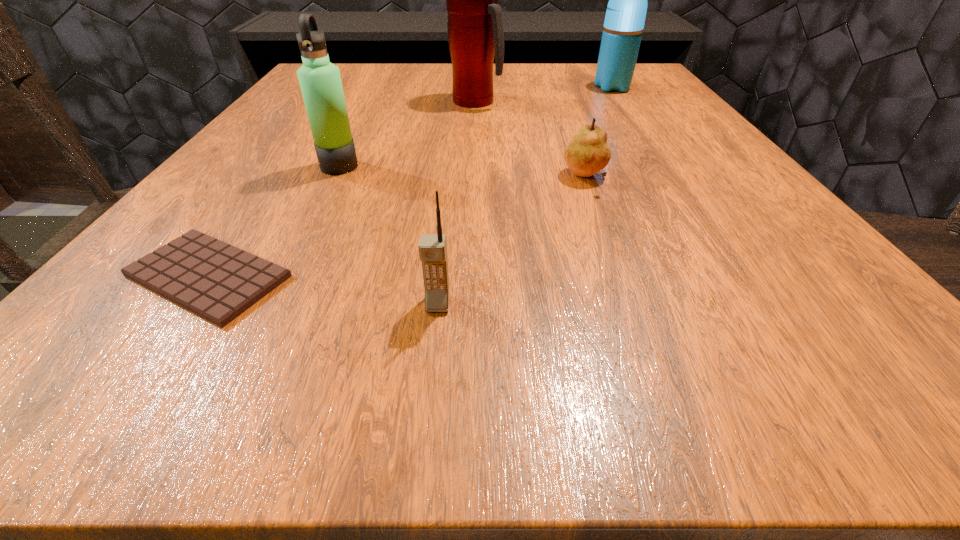
At what (x,y) coordinates should I click in order to perform the action: click on free spot located 0.380m on the back of the pear. Please return your answer as a coordinate pair (x, y). The height and width of the screenshot is (540, 960). Looking at the image, I should click on (552, 88).

Locate an element on the screen. The height and width of the screenshot is (540, 960). vacant space situated 0.190m on the right of the shortest object is located at coordinates (454, 276).

This screenshot has width=960, height=540. I want to click on object at the near edge, so click(x=217, y=281).

You are a GUI agent. You are given a task and a screenshot of the screen. Output one action in this format:
    pyautogui.click(x=<x>, y=<y>)
    Task: Click on the thermos bottle present at the left edge
    Image resolution: width=960 pixels, height=540 pixels.
    Given the screenshot: What is the action you would take?
    pyautogui.click(x=320, y=81)

In order to click on chocolate bar present at the left edge in this screenshot , I will do `click(217, 281)`.

Identify the location of object at the right edge. This screenshot has width=960, height=540. (625, 16).

The width and height of the screenshot is (960, 540). What are the coordinates of `object that is at the near left corner` in the screenshot? It's located at (217, 281).

At what (x,y) coordinates should I click in order to perform the action: click on object present at the far right corner. Please return your answer as a coordinate pair (x, y). Looking at the image, I should click on (625, 16).

Find the location of a particular element. blank space at the far edge of the desktop is located at coordinates (451, 65).

At what (x,y) coordinates should I click in order to perform the action: click on free spot at the near edge of the desktop. Please return your answer as a coordinate pair (x, y). Image resolution: width=960 pixels, height=540 pixels. Looking at the image, I should click on (419, 335).